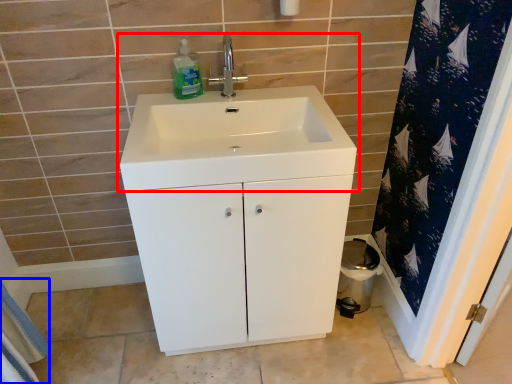
Question: Which of the following is the farthest to the observer, sink (highlighted by a red box) or bath towel (highlighted by a blue box)?

Choices:
 (A) sink
 (B) bath towel

Answer: (B)